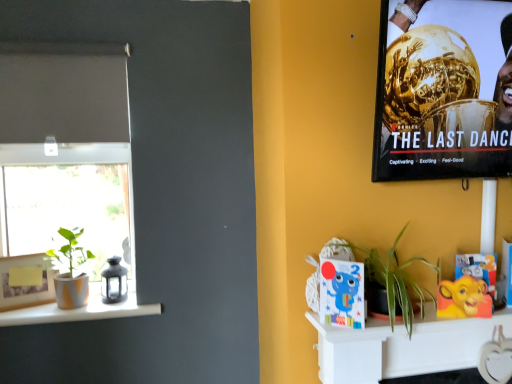
Question: Is metallic gold trophy at upper right facing away from white matte shelf at lower right?

Choices:
 (A) no
 (B) yes

Answer: (A)

Question: From the image's perspective, would you say metallic gold trophy at upper right is shown under white matte shelf at lower right?

Choices:
 (A) no
 (B) yes

Answer: (A)

Question: Can you confirm if metallic gold trophy at upper right is thinner than white matte shelf at lower right?

Choices:
 (A) yes
 (B) no

Answer: (B)

Question: Considering the relative sizes of metallic gold trophy at upper right and white matte shelf at lower right in the image provided, is metallic gold trophy at upper right taller than white matte shelf at lower right?

Choices:
 (A) yes
 (B) no

Answer: (A)

Question: Is the position of metallic gold trophy at upper right more distant than that of white matte shelf at lower right?

Choices:
 (A) no
 (B) yes

Answer: (A)

Question: From the image's perspective, is green matte plant at left, which appears as the 2th houseplant when viewed from the front, positioned above or below cartoon blue elephant at center?

Choices:
 (A) above
 (B) below

Answer: (B)

Question: Is green matte plant at left, which appears as the 2th houseplant when viewed from the front, situated inside cartoon blue elephant at center or outside?

Choices:
 (A) outside
 (B) inside

Answer: (A)

Question: Considering the positions of point (61, 248) and point (354, 279), is point (61, 248) closer or farther from the camera than point (354, 279)?

Choices:
 (A) closer
 (B) farther

Answer: (B)

Question: Looking at their shapes, would you say green matte plant at left, which is the 1th houseplant from left to right, is wider or thinner than cartoon blue elephant at center?

Choices:
 (A) wide
 (B) thin

Answer: (A)

Question: Considering the positions of green leafy plant at center-right, marked as the second houseplant in a left-to-right arrangement, and cartoon blue elephant at center in the image, is green leafy plant at center-right, marked as the second houseplant in a left-to-right arrangement, taller or shorter than cartoon blue elephant at center?

Choices:
 (A) short
 (B) tall

Answer: (B)

Question: Do you think green leafy plant at center-right, marked as the second houseplant in a left-to-right arrangement, is within cartoon blue elephant at center, or outside of it?

Choices:
 (A) outside
 (B) inside

Answer: (A)

Question: Looking at their shapes, would you say green leafy plant at center-right, which is the first houseplant in right-to-left order, is wider or thinner than cartoon blue elephant at center?

Choices:
 (A) thin
 (B) wide

Answer: (B)

Question: In the image, is green leafy plant at center-right, which is the second houseplant from back to front, positioned in front of or behind cartoon blue elephant at center?

Choices:
 (A) behind
 (B) front

Answer: (B)

Question: Is green matte plant at left, which is the 1th houseplant from left to right, in front of or behind white matte shelf at lower right in the image?

Choices:
 (A) front
 (B) behind

Answer: (B)

Question: In terms of size, does green matte plant at left, which is counted as the 2th houseplant, starting from the right, appear bigger or smaller than white matte shelf at lower right?

Choices:
 (A) small
 (B) big

Answer: (B)